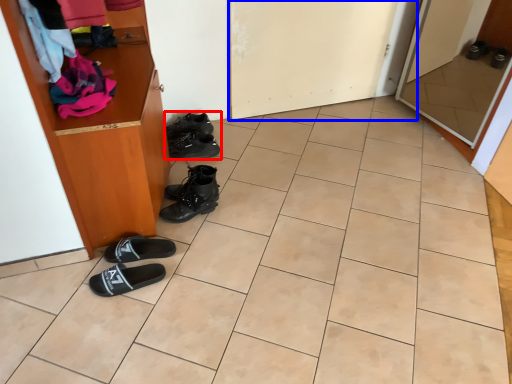
Question: Which object is further to the camera taking this photo, footwear (highlighted by a red box) or door (highlighted by a blue box)?

Choices:
 (A) footwear
 (B) door

Answer: (A)